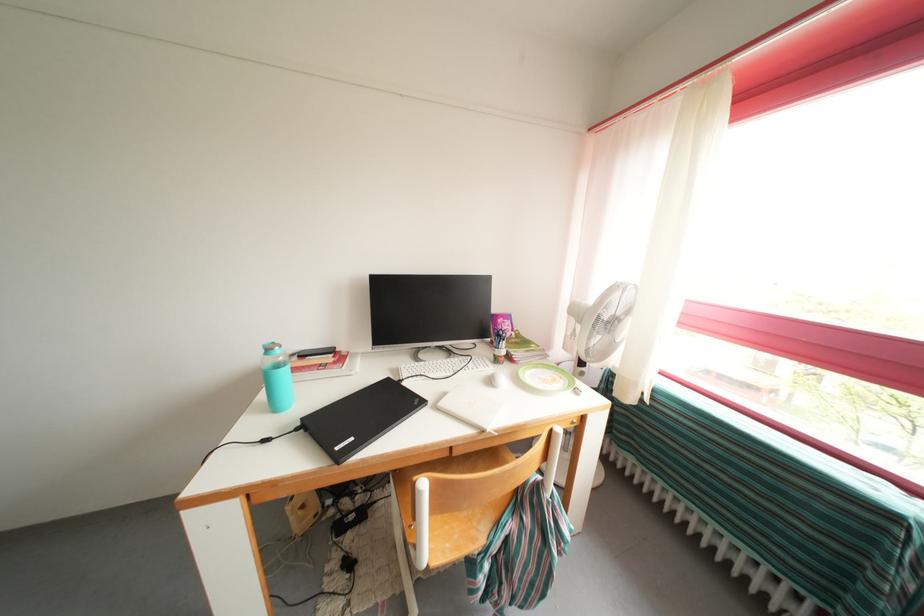
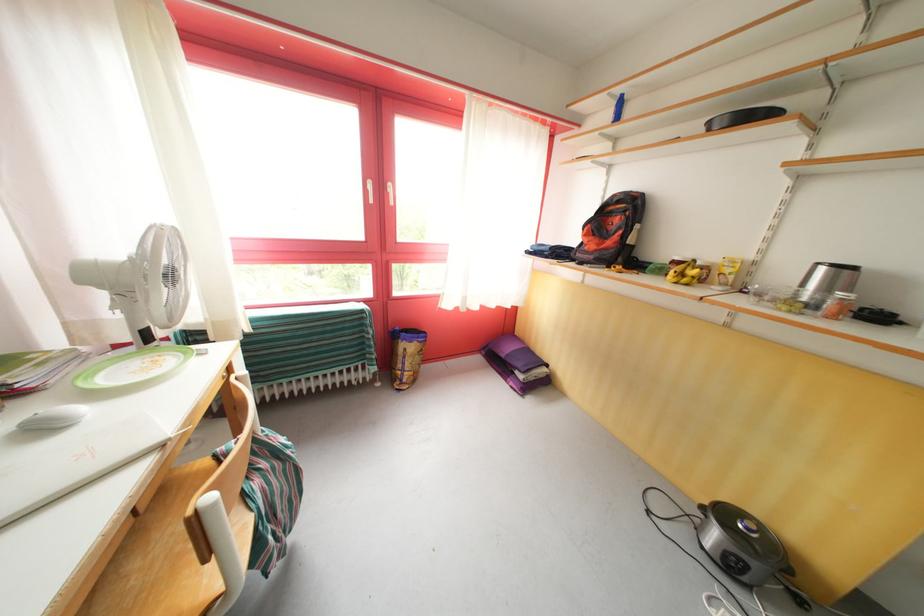
The point at (480,546) is marked in the first image. Where is the corresponding point in the second image?

(251, 535)